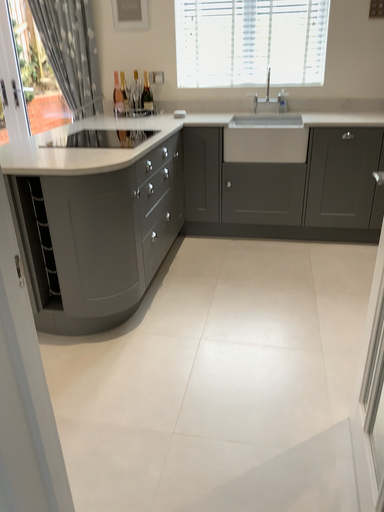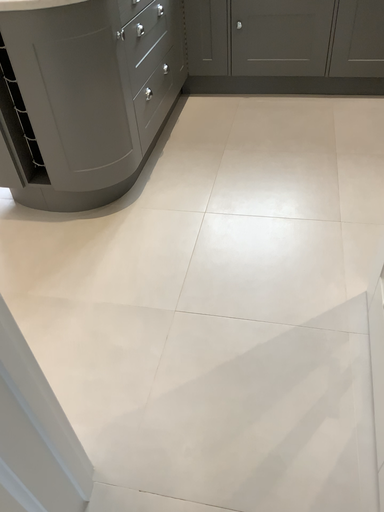
Question: Which way did the camera rotate in the video?

Choices:
 (A) rotated upward
 (B) rotated downward

Answer: (B)